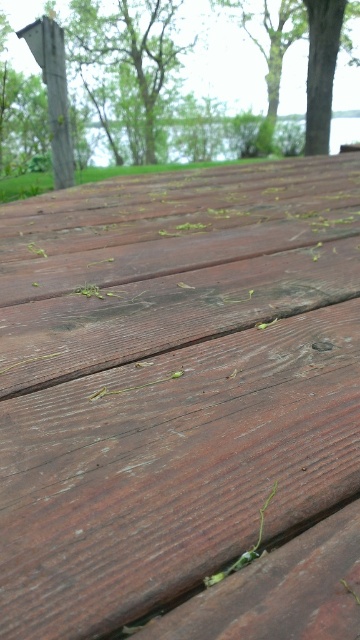
You are standing on the wooden deck and want to place a potted plant. The potted plant must be placed on the dark brown wood at center and under the green leafy tree at upper center. Is this possible?

The dark brown wood at center is located below the green leafy tree at upper center, so yes, placing the potted plant on the dark brown wood at center would position it under the green leafy tree at upper center.

You are standing on the wooden deck and want to place a tall potted plant between the dark brown wood at center and the green leafy tree at upper center. Which object should the plant be placed closer to?

The plant should be placed closer to the dark brown wood at center because it is shorter than the green leafy tree at upper center.

You are standing on the wooden deck and notice the smooth gray post at upper left and the green leafy tree at upper center. Which object is taller?

The green leafy tree at upper center is taller than the smooth gray post at upper left.